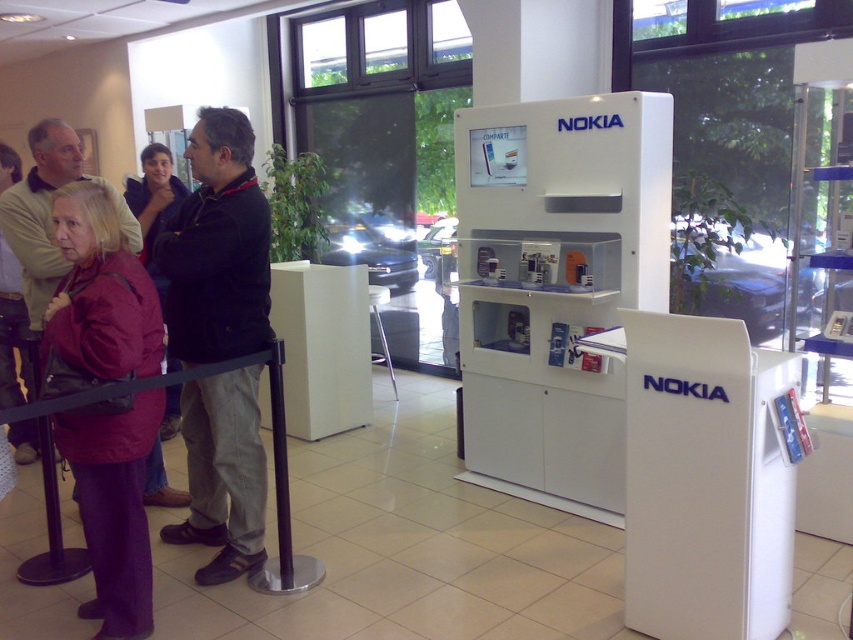
You are a store employee who needs to place a new display item that requires a surface area of 1.2 square feet. Looking at the dark gray jacket at center and the matte red jacket at left, which jacket should you choose to place the item on?

The dark gray jacket at center is larger in size than the matte red jacket at left, so the dark gray jacket at center can accommodate the item requiring 1.2 square feet of surface area.

You are a customer in the Nokia store and you want to try on the maroon fabric jacket at left. The jacket is located at point (x=100, y=291). The store has a fitting room 2 meters away from the jacket. If you walk straight from the jacket to the fitting room, will you pass by the white Nokia display stand?

The maroon fabric jacket at left is located at point (x=100, y=291). The white Nokia display stand is in the foreground, so walking straight from the jacket to the fitting room would pass by the white Nokia display stand.